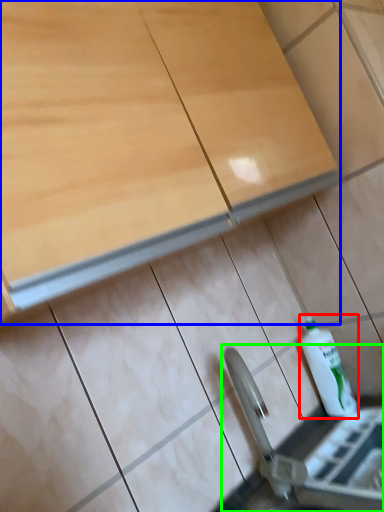
Question: Estimate the real-world distances between objects in this image. Which object is farther from bottle (highlighted by a red box), cabinetry (highlighted by a blue box) or sink (highlighted by a green box)?

Choices:
 (A) cabinetry
 (B) sink

Answer: (A)